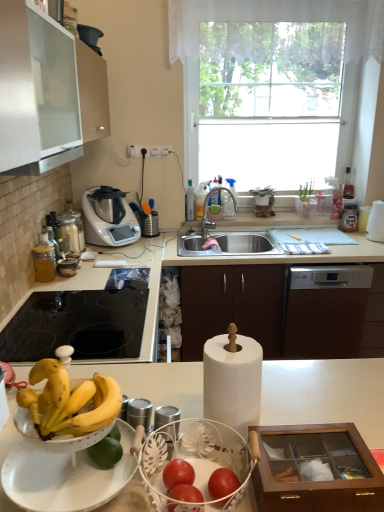
Question: From the image's perspective, is white lace curtain at upper center positioned above or below transparent glass window at upper center?

Choices:
 (A) below
 (B) above

Answer: (B)

Question: Is white lace curtain at upper center bigger or smaller than transparent glass window at upper center?

Choices:
 (A) big
 (B) small

Answer: (B)

Question: Considering the real-world distances, which object is farthest from the matte silver faucet at sink center?

Choices:
 (A) metallic silver blender at upper right, which is the first appliance in back-to-front order
 (B) transparent glass window at upper center
 (C) black glass cooktop at lower left
 (D) white lace curtain at upper center
 (E) metallic silver food processor at center-left

Answer: (C)

Question: Which of these objects is positioned farthest from the metallic silver blender at upper right, acting as the 2th appliance starting from the right?

Choices:
 (A) black glass cooktop at lower left
 (B) white paper towel at center
 (C) white lace curtain at upper center
 (D) matte silver faucet at sink center
 (E) white plastic cup at right, which appears as the second appliance when viewed from the back

Answer: (B)